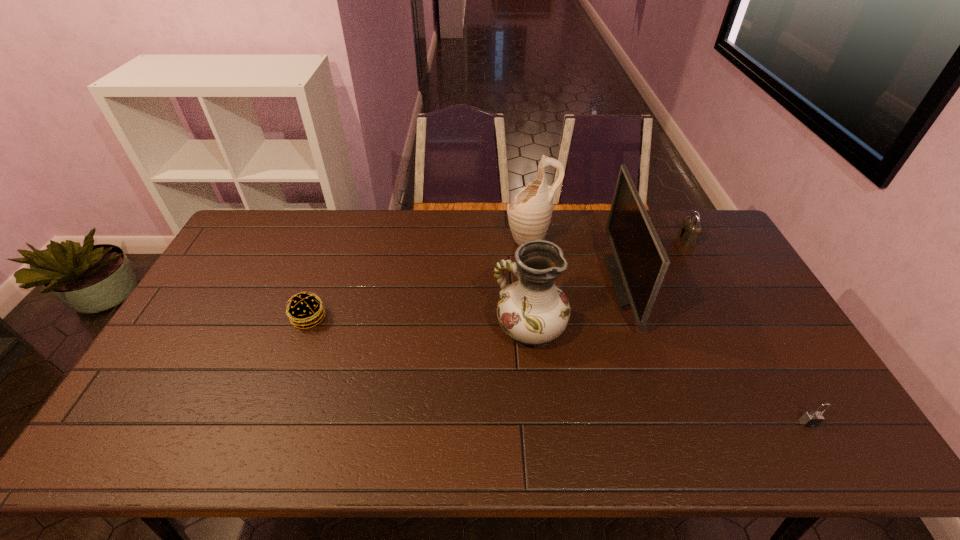
In order to click on monitor situated at the far edge in this screenshot , I will do `click(637, 271)`.

You are a GUI agent. You are given a task and a screenshot of the screen. Output one action in this format:
    pyautogui.click(x=<x>, y=<y>)
    Task: Click on the padlock that is at the far edge
    
    Given the screenshot: What is the action you would take?
    pyautogui.click(x=689, y=232)

Identify the location of object at the near edge. The width and height of the screenshot is (960, 540). (813, 418).

At what (x,y) coordinates should I click in order to perform the action: click on object present at the far right corner. Please return your answer as a coordinate pair (x, y). This screenshot has width=960, height=540. Looking at the image, I should click on (689, 232).

The image size is (960, 540). What are the coordinates of `object located in the near right corner section of the desktop` in the screenshot? It's located at (813, 418).

Locate an element on the screen. The height and width of the screenshot is (540, 960). free space at the far edge of the desktop is located at coordinates (601, 223).

In order to click on vacant area at the near edge of the desktop in this screenshot , I will do `click(221, 454)`.

Image resolution: width=960 pixels, height=540 pixels. What are the coordinates of `free space at the left edge of the desktop` in the screenshot? It's located at (237, 251).

Find the location of a particular element. Image resolution: width=960 pixels, height=540 pixels. blank space at the far left corner is located at coordinates (283, 223).

I want to click on free point between the leftmost object and the vase, so click(x=419, y=323).